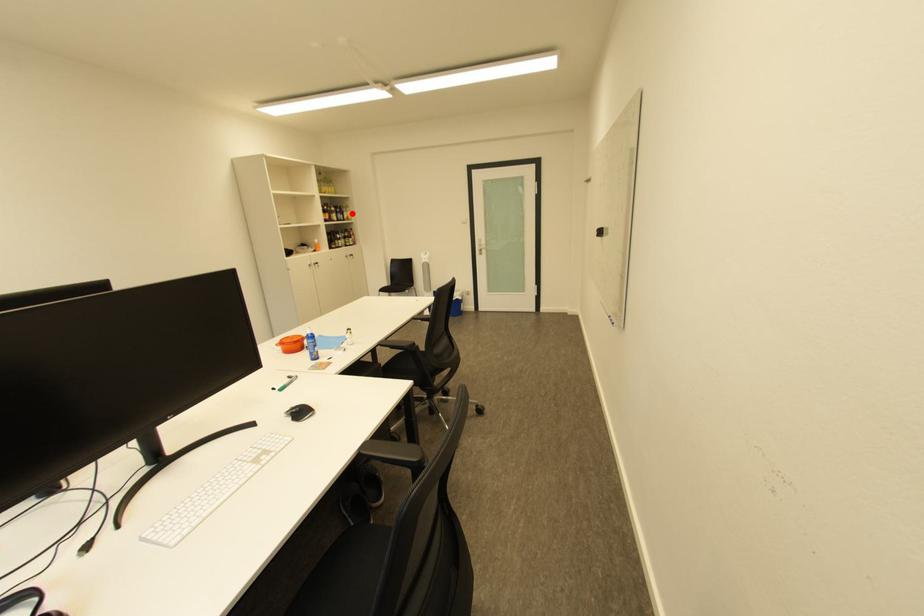
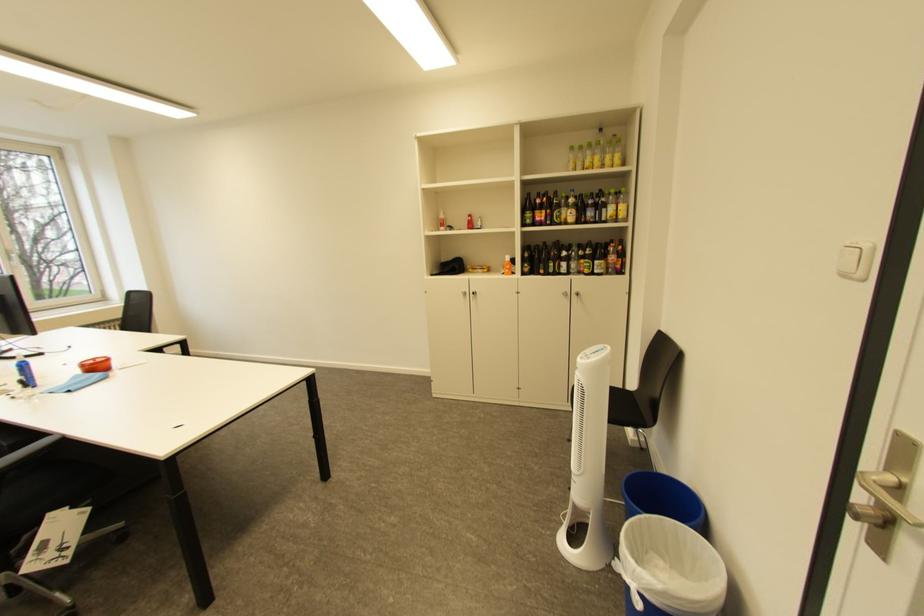
The point at the highlighted location is marked in the first image. Where is the corresponding point in the second image?

(610, 208)